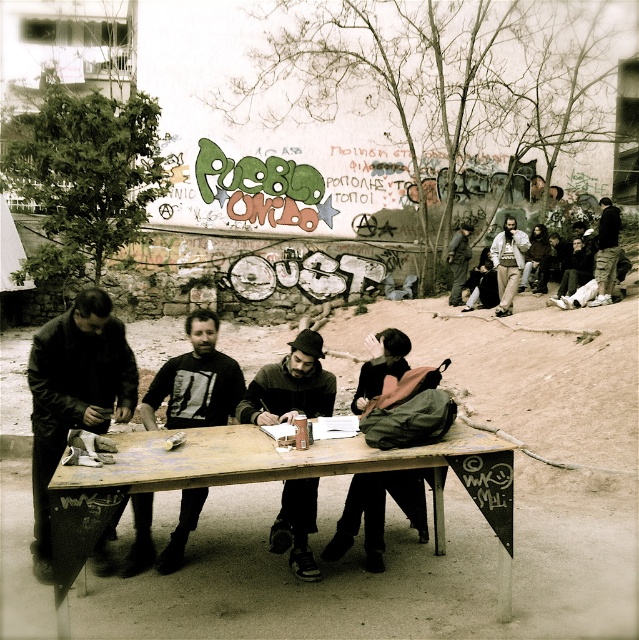
You are standing at the origin point of a coordinate system placed at the bottom left corner of the image. You need to locate the wooden table at center. What are its coordinates?

The wooden table at center is located at coordinates point (261, 481).

You are a person who wants to sit at the table but needs to make space for your backpack. The dark brown leather jacket at left and camouflage pants at right are in the way. Which item should you move to the left to create space on the right side of the table?

You should move the camouflage pants at right to the left since the dark brown leather jacket at left is already on the left side, and moving the camouflage pants at right would free up space on the right.